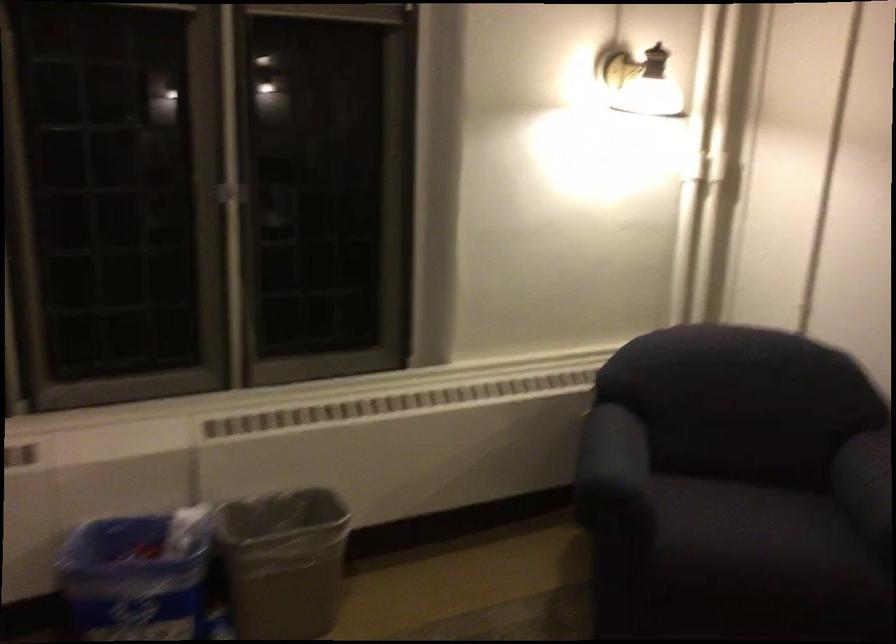
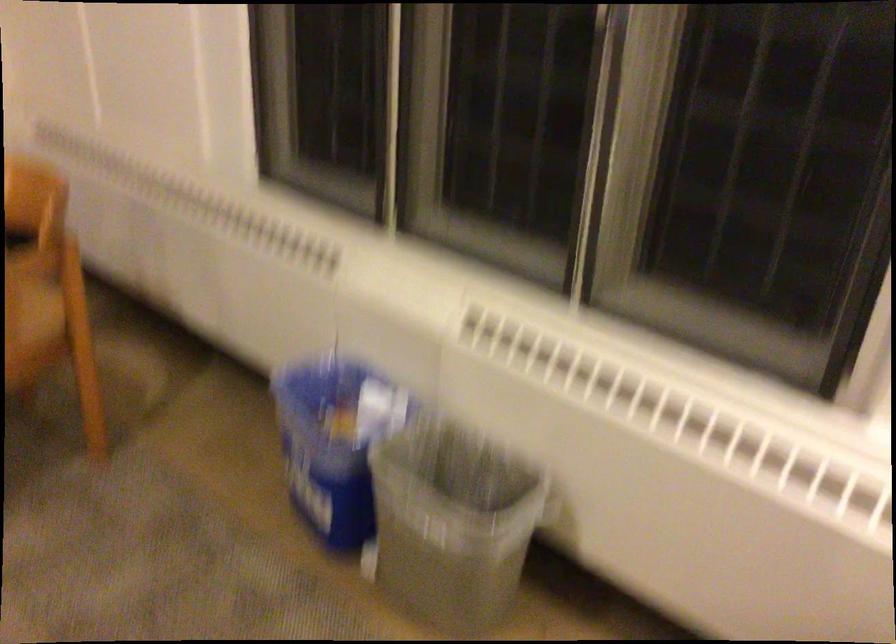
Find the pixel in the second image that matches (x=332, y=534) in the first image.

(451, 524)